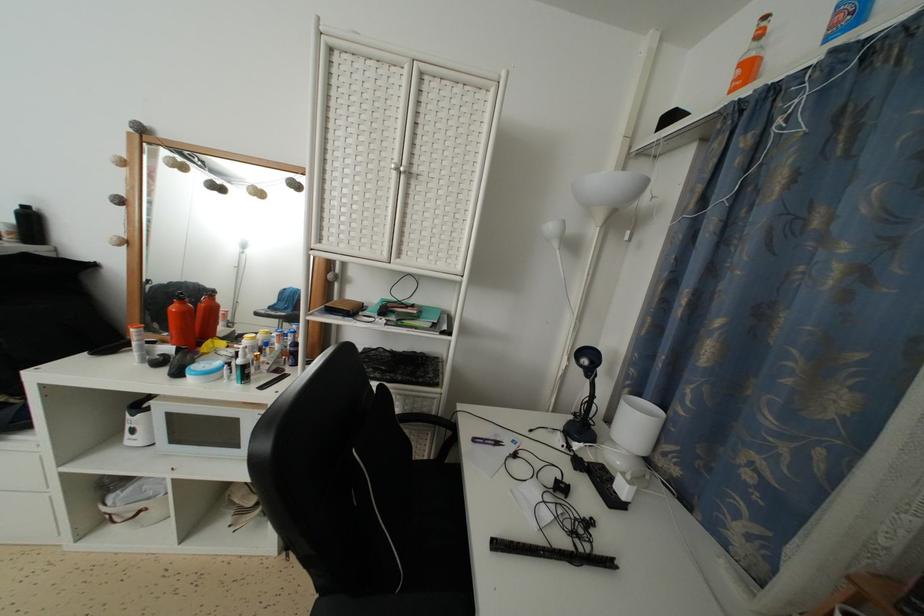
The location [750,57] corresponds to which object?

This point indicates the white spray bottle.